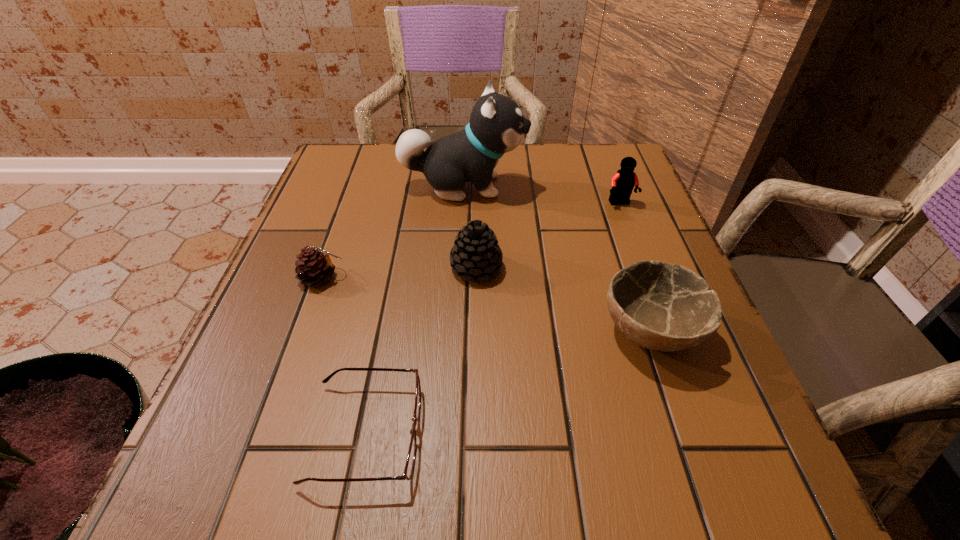
Where is `puppy`? puppy is located at coordinates (496, 126).

The height and width of the screenshot is (540, 960). I want to click on Lego, so click(x=622, y=183).

This screenshot has height=540, width=960. Identify the location of the right pinecone. (476, 253).

You are a GUI agent. You are given a task and a screenshot of the screen. Output one action in this format:
    pyautogui.click(x=<x>, y=<y>)
    Task: Click on the fourth tallest object
    
    Given the screenshot: What is the action you would take?
    pyautogui.click(x=659, y=306)

Locate an element on the screen. Image resolution: width=960 pixels, height=540 pixels. bowl is located at coordinates (659, 306).

The image size is (960, 540). Identify the location of the shorter pinecone. (314, 267).

Where is `the leftmost object`? The height and width of the screenshot is (540, 960). the leftmost object is located at coordinates (314, 267).

You are a GUI agent. You are given a task and a screenshot of the screen. Output one action in this format:
    pyautogui.click(x=<x>, y=<y>)
    Task: Click on the shortest object
    Image resolution: width=960 pixels, height=540 pixels.
    Given the screenshot: What is the action you would take?
    pyautogui.click(x=410, y=461)

This screenshot has width=960, height=540. Find the location of `the nearest object`. the nearest object is located at coordinates (410, 461).

Locate an element on the screen. The height and width of the screenshot is (540, 960). free space located at the face of the puppy is located at coordinates (596, 186).